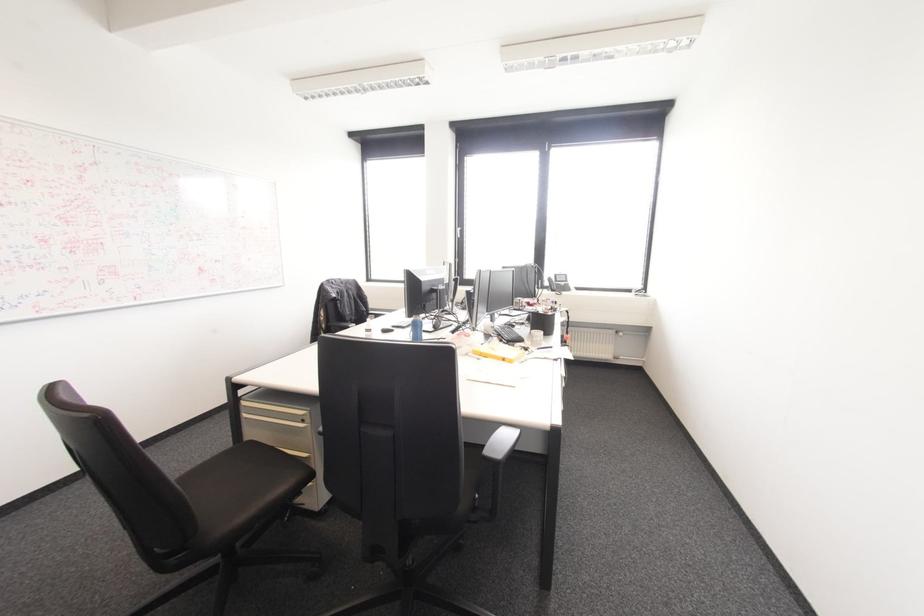
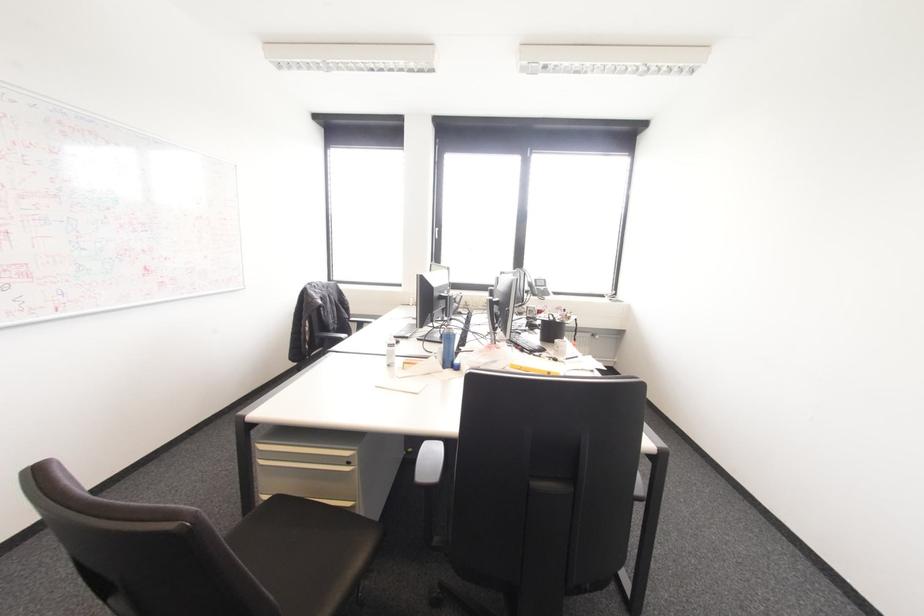
Question: The camera is either moving clockwise (left) or counter-clockwise (right) around the object. The first image is from the beginning of the video and the second image is from the end. Is the camera moving left or right when shooting the video?

Choices:
 (A) Left
 (B) Right

Answer: (A)